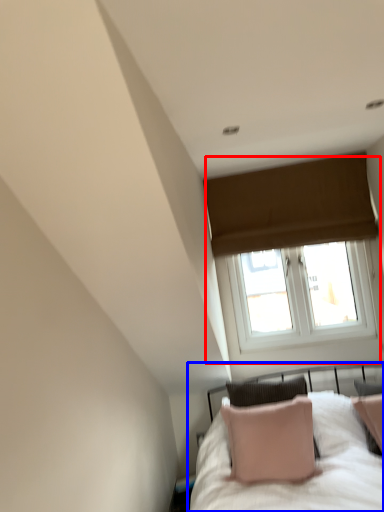
Question: Which object appears farthest to the camera in this image, window (highlighted by a red box) or bed (highlighted by a blue box)?

Choices:
 (A) window
 (B) bed

Answer: (A)